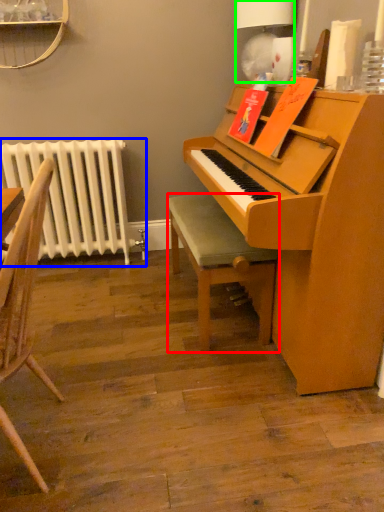
Question: Estimate the real-world distances between objects in this image. Which object is farther from stool (highlighted by a red box), radiator (highlighted by a blue box) or lamp (highlighted by a green box)?

Choices:
 (A) radiator
 (B) lamp

Answer: (B)